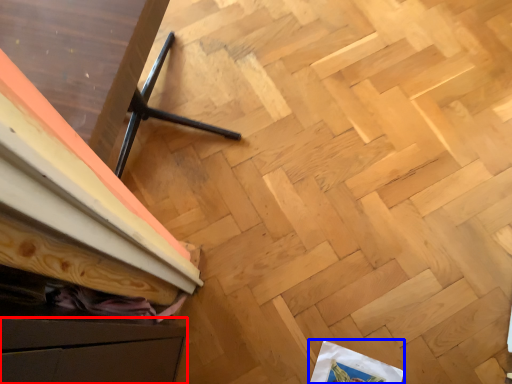
Question: Which point is further to the camera, drawer (highlighted by a red box) or wrapping paper (highlighted by a blue box)?

Choices:
 (A) drawer
 (B) wrapping paper

Answer: (B)